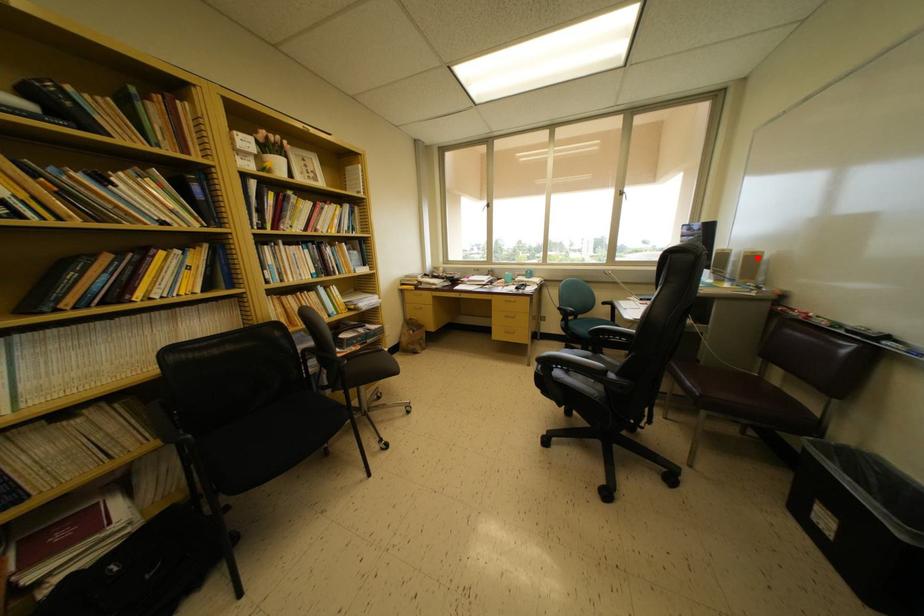
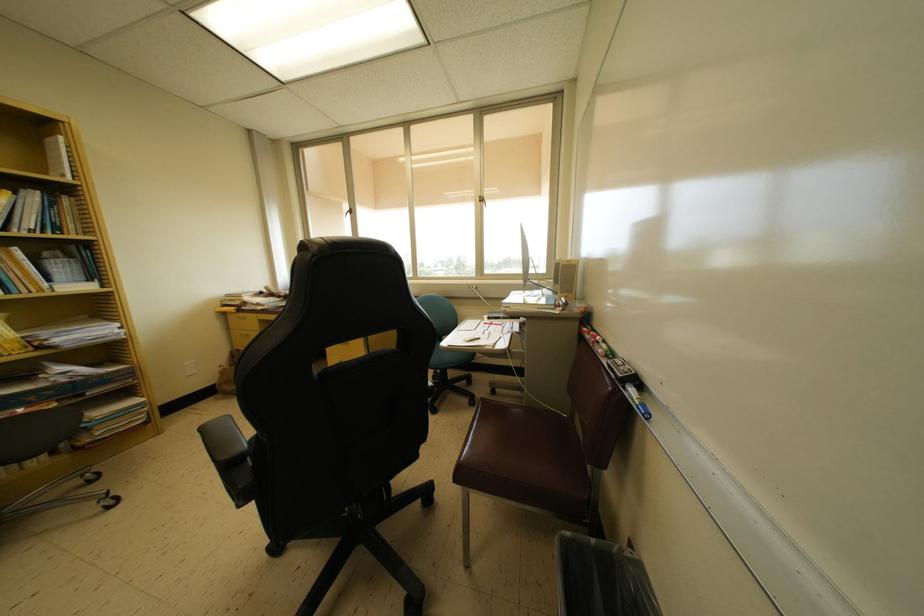
Question: I am providing you with two images of the same scene from different viewpoints. A red point is marked on the first image. At the location where the point appears in image 1, is it still visible in image 2?

Choices:
 (A) Yes
 (B) No

Answer: (A)